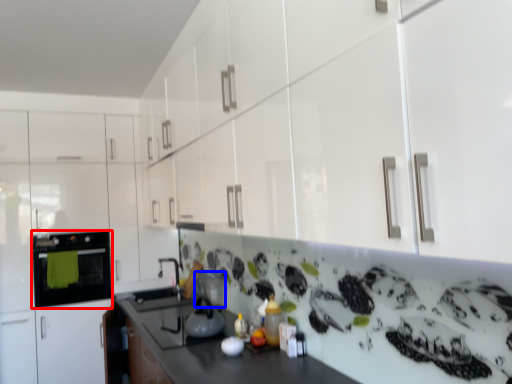
Question: Among these objects, which one is farthest to the camera, home appliance (highlighted by a red box) or appliance (highlighted by a blue box)?

Choices:
 (A) home appliance
 (B) appliance

Answer: (A)